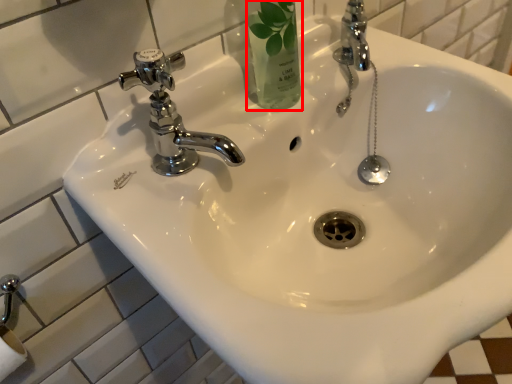
Question: Observing the image, what is the correct spatial positioning of mouthwash (annotated by the red box) in reference to tap?

Choices:
 (A) right
 (B) left

Answer: (A)